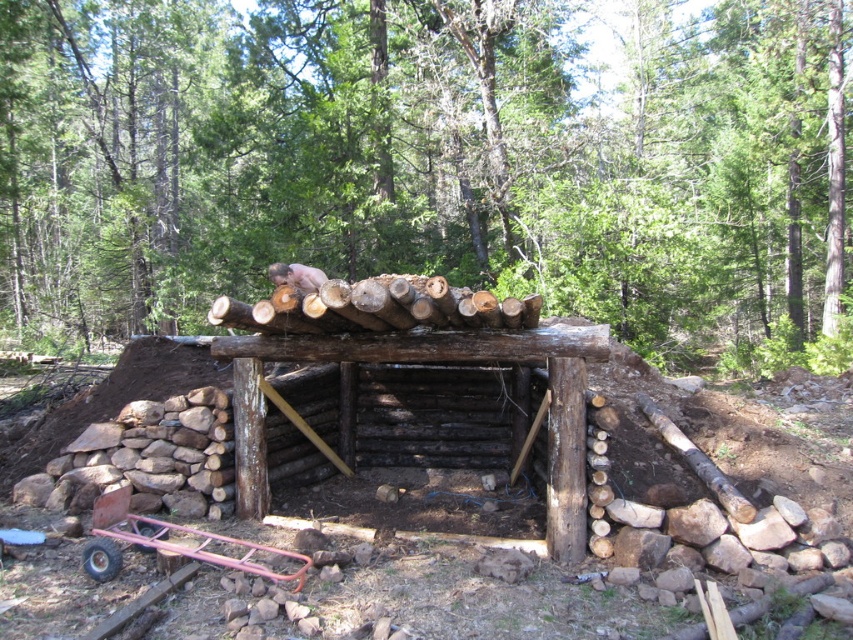
Does brown rough wood at upper center have a larger size compared to metallic pink cart at lower left?

Indeed, brown rough wood at upper center has a larger size compared to metallic pink cart at lower left.

Based on the photo, who is shorter, brown rough wood at upper center or metallic pink cart at lower left?

→ metallic pink cart at lower left

Who is more forward, (618, 310) or (99, 564)?

Point (99, 564)

Find the location of a particular element. This screenshot has height=640, width=853. brown rough wood at upper center is located at coordinates (428, 163).

Who is positioned more to the right, natural wood log shelter at center or metallic pink cart at lower left?

natural wood log shelter at center is more to the right.

Between point (547, 417) and point (85, 572), which one is positioned in front?

Point (85, 572) is in front.

Is point (408, 380) more distant than point (106, 564)?

Yes, it is.

Locate an element on the screen. The height and width of the screenshot is (640, 853). natural wood log shelter at center is located at coordinates (424, 381).

Can you confirm if brown rough wood at upper center is bigger than natural wood log shelter at center?

Yes.

Can you confirm if brown rough wood at upper center is wider than natural wood log shelter at center?

Yes, brown rough wood at upper center is wider than natural wood log shelter at center.

Measure the distance between point (495, 284) and camera.

The distance of point (495, 284) from camera is 43.65 feet.

You are a GUI agent. You are given a task and a screenshot of the screen. Output one action in this format:
    pyautogui.click(x=<x>, y=<y>)
    Task: Click on the brown rough wood at upper center
    This screenshot has width=853, height=640.
    Given the screenshot: What is the action you would take?
    pyautogui.click(x=428, y=163)